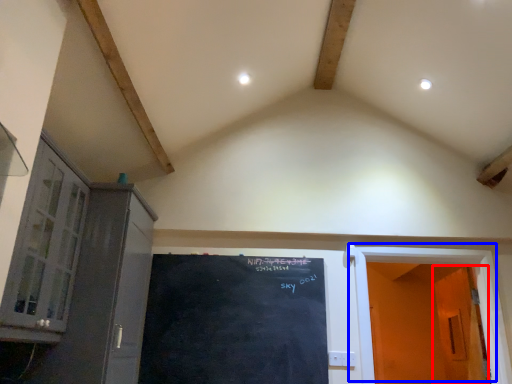
Question: Among these objects, which one is farthest to the camera, door (highlighted by a red box) or door (highlighted by a blue box)?

Choices:
 (A) door
 (B) door

Answer: (A)